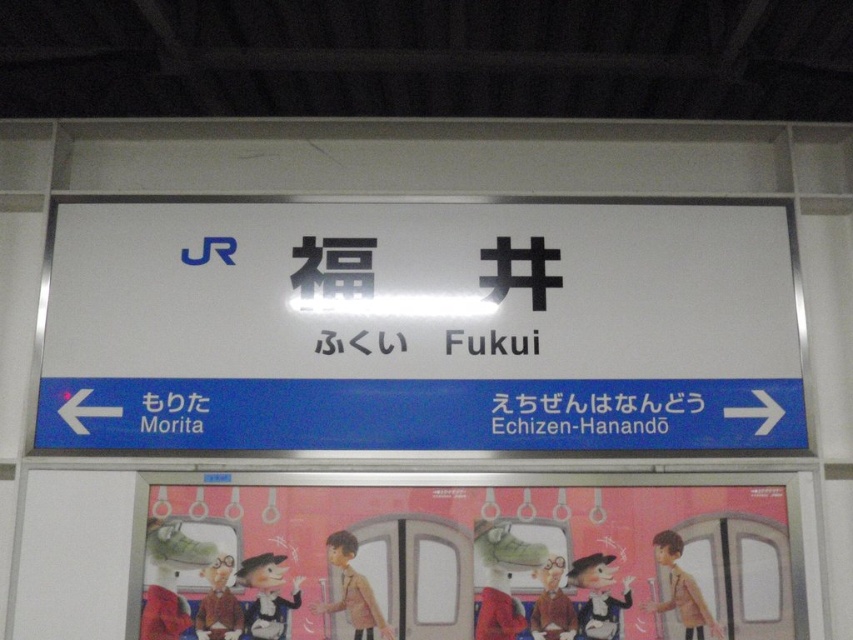
Between white plastic sign at center and cartoon characters at center, which one appears on the right side from the viewer's perspective?

From the viewer's perspective, cartoon characters at center appears more on the right side.

Which of these two, white plastic sign at center or cartoon characters at center, stands shorter?

With less height is cartoon characters at center.

Which is in front, point (558, 292) or point (216, 624)?

Point (216, 624) is more forward.

Locate an element on the screen. The image size is (853, 640). white plastic sign at center is located at coordinates (421, 326).